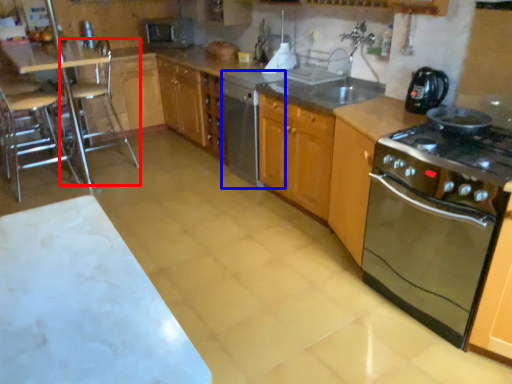
Question: Among these objects, which one is nearest to the camera, bar stool (highlighted by a red box) or dish washer (highlighted by a blue box)?

Choices:
 (A) bar stool
 (B) dish washer

Answer: (B)